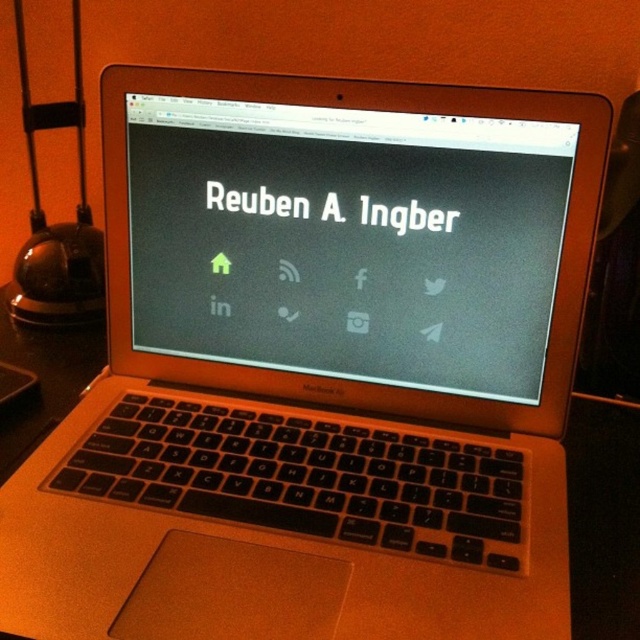
Does black matte screen at center appear under metallic glass table lamp at left?

Yes, black matte screen at center is below metallic glass table lamp at left.

Identify the location of black matte screen at center. (348, 241).

Measure the distance between point (170, 317) and camera.

Point (170, 317) is 23.43 inches from camera.

Identify the location of black matte screen at center. (348, 241).